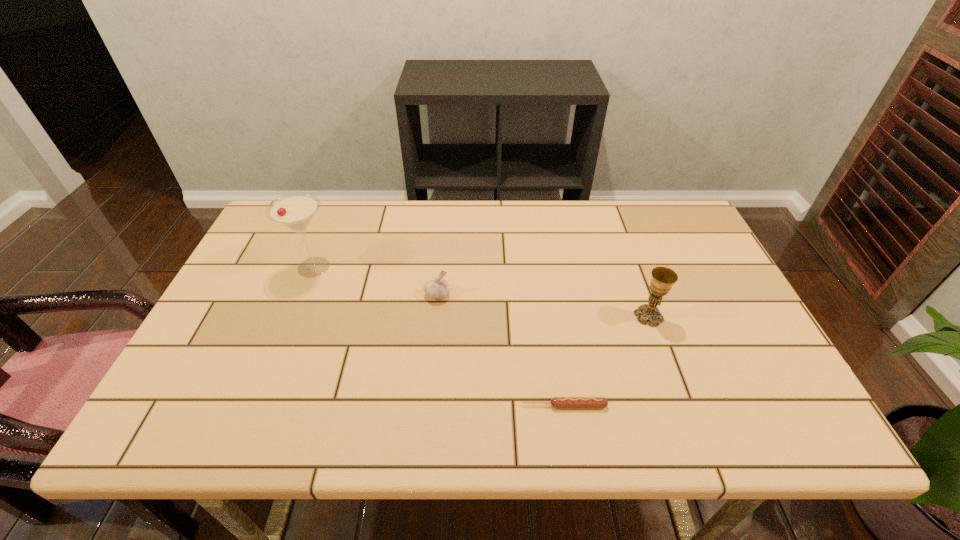
You are a GUI agent. You are given a task and a screenshot of the screen. Output one action in this format:
    pyautogui.click(x=<x>, y=<y>)
    Task: Click on the vacant space in between the nearest object and the tallest object
    
    Given the screenshot: What is the action you would take?
    pyautogui.click(x=439, y=336)

The height and width of the screenshot is (540, 960). In order to click on free space between the third farthest object and the third nearest object in this screenshot , I will do `click(543, 305)`.

At what (x,y) coordinates should I click in order to perform the action: click on empty space that is in between the rightmost object and the tallest object. Please return your answer as a coordinate pair (x, y). This screenshot has width=960, height=540. Looking at the image, I should click on coord(481,292).

Identify the location of vacant area that lies between the garlic and the sausage. Image resolution: width=960 pixels, height=540 pixels. (501, 350).

The width and height of the screenshot is (960, 540). Identify the location of blank region between the second tallest object and the garlic. (543, 305).

In order to click on vacant space that's between the third object from left to right and the third farthest object in this screenshot , I will do `click(607, 361)`.

Find the location of `unoccupied position between the third shortest object and the farthest object`. unoccupied position between the third shortest object and the farthest object is located at coordinates (481, 292).

Identify the location of free space between the third nearest object and the nearest object. (501, 350).

I want to click on free spot between the farthest object and the third object from left to right, so (439, 336).

Locate an element on the screen. The image size is (960, 540). the closest object to the second nearest object is located at coordinates (556, 402).